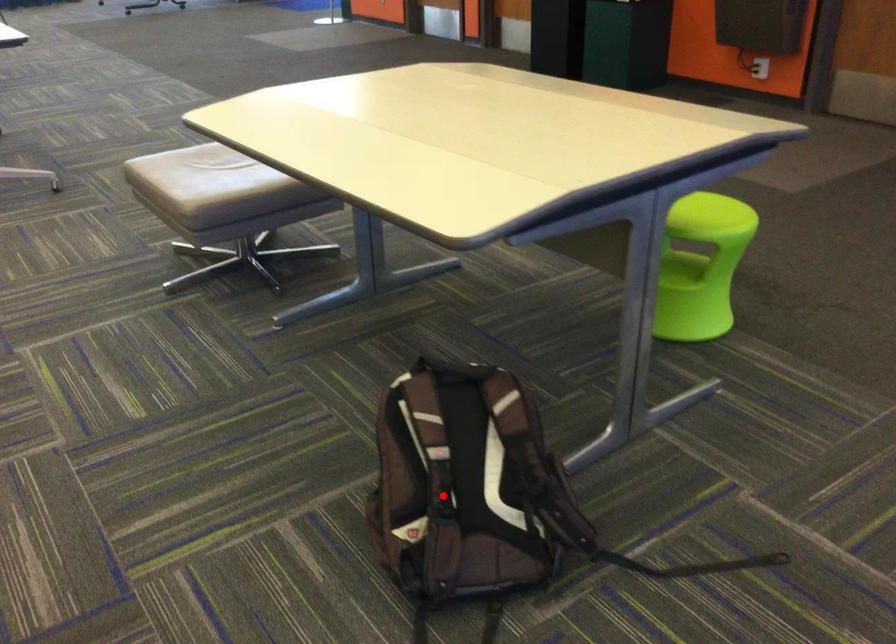
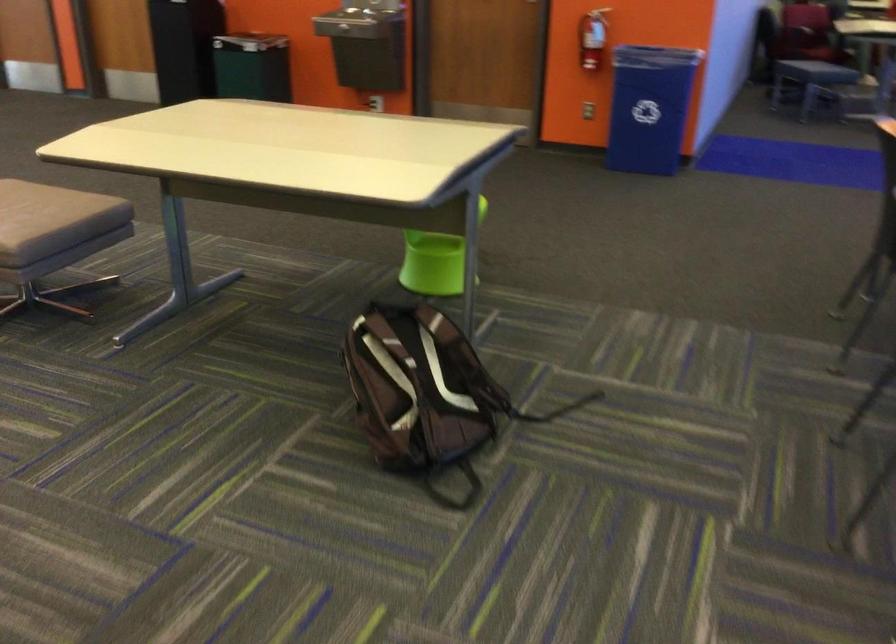
Question: I am providing you with two images of the same scene from different viewpoints. A red point is shown in image1. For the corresponding object point in image2, is it positioned nearer or farther from the camera?

Choices:
 (A) Nearer
 (B) Farther

Answer: (B)